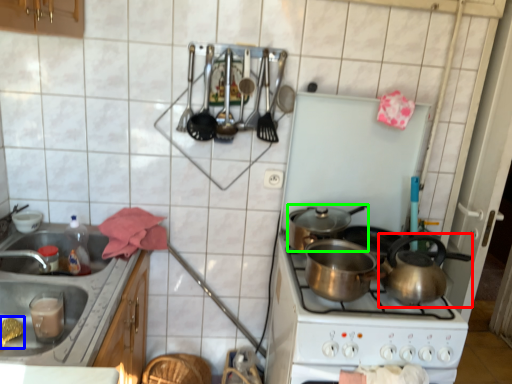
Question: Which is nearer to the tea pot (highlighted by a red box)? food (highlighted by a blue box) or kitchen appliance (highlighted by a green box).

Choices:
 (A) food
 (B) kitchen appliance

Answer: (B)